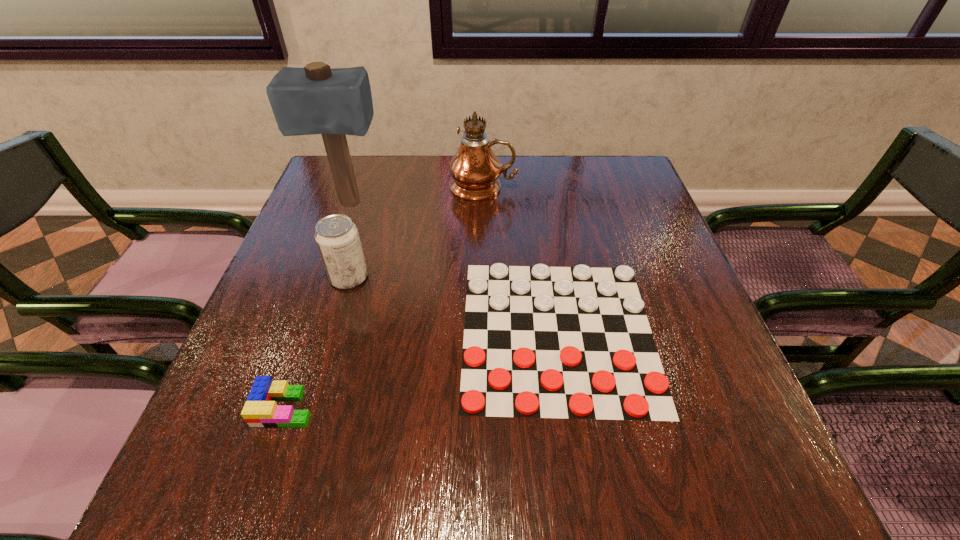
Locate an element on the screen. This screenshot has width=960, height=540. oil lamp that is at the far edge is located at coordinates (475, 169).

Where is `mallet present at the far edge`? This screenshot has width=960, height=540. mallet present at the far edge is located at coordinates (316, 99).

Image resolution: width=960 pixels, height=540 pixels. Find the location of `mallet present at the left edge`. mallet present at the left edge is located at coordinates (316, 99).

In order to click on soda can located in the left edge section of the desktop in this screenshot , I will do `click(337, 237)`.

This screenshot has width=960, height=540. In order to click on Lego located in the left edge section of the desktop in this screenshot , I will do `click(260, 410)`.

This screenshot has height=540, width=960. I want to click on object present at the right edge, so click(x=576, y=343).

At what (x,y) coordinates should I click in order to perform the action: click on object located in the far left corner section of the desktop. Please return your answer as a coordinate pair (x, y). Looking at the image, I should click on (316, 99).

Image resolution: width=960 pixels, height=540 pixels. Identify the location of free spot at the far edge of the desktop. (563, 198).

The image size is (960, 540). In the image, there is a desktop. What are the coordinates of `free space at the left edge` in the screenshot? It's located at (361, 229).

You are a GUI agent. You are given a task and a screenshot of the screen. Output one action in this format:
    pyautogui.click(x=<x>, y=<y>)
    Task: Click on the free space at the right edge of the desktop
    The width and height of the screenshot is (960, 540).
    Given the screenshot: What is the action you would take?
    point(689,310)